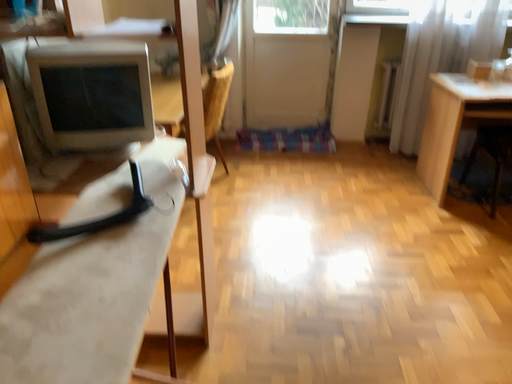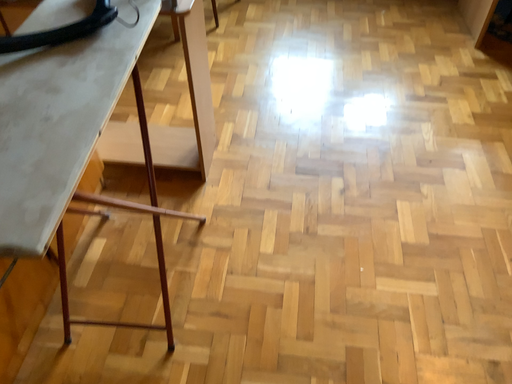
Question: Which way did the camera rotate in the video?

Choices:
 (A) rotated upward
 (B) rotated downward

Answer: (B)